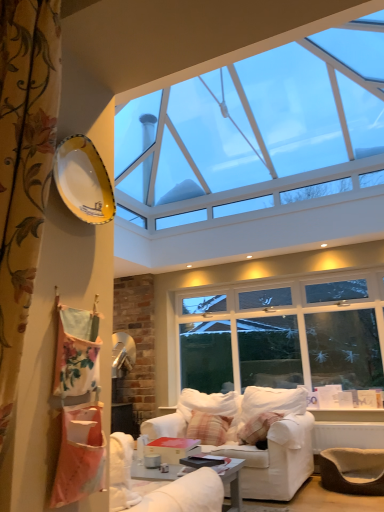
Question: Could you tell me if transparent glass window at upper center is turned towards yellow glossy plate at upper left?

Choices:
 (A) yes
 (B) no

Answer: (B)

Question: Would you say transparent glass window at upper center is a long distance from yellow glossy plate at upper left?

Choices:
 (A) yes
 (B) no

Answer: (A)

Question: From the image's perspective, is transparent glass window at upper center beneath yellow glossy plate at upper left?

Choices:
 (A) yes
 (B) no

Answer: (B)

Question: Is yellow glossy plate at upper left located within transparent glass window at upper center?

Choices:
 (A) yes
 (B) no

Answer: (B)

Question: Does transparent glass window at upper center appear on the right side of yellow glossy plate at upper left?

Choices:
 (A) yes
 (B) no

Answer: (A)

Question: Considering the positions of white fabric couch at center and plaid fabric pillow at center in the image, is white fabric couch at center bigger or smaller than plaid fabric pillow at center?

Choices:
 (A) big
 (B) small

Answer: (A)

Question: Choose the correct answer: Is white fabric couch at center inside plaid fabric pillow at center or outside it?

Choices:
 (A) inside
 (B) outside

Answer: (B)

Question: From a real-world perspective, is white fabric couch at center positioned above or below plaid fabric pillow at center?

Choices:
 (A) below
 (B) above

Answer: (A)

Question: From the image's perspective, is white fabric couch at center above or below plaid fabric pillow at center?

Choices:
 (A) below
 (B) above

Answer: (A)

Question: Considering the positions of transparent glass window at upper center and plaid fabric pillow at center in the image, is transparent glass window at upper center bigger or smaller than plaid fabric pillow at center?

Choices:
 (A) small
 (B) big

Answer: (B)

Question: Visually, is transparent glass window at upper center positioned to the left or to the right of plaid fabric pillow at center?

Choices:
 (A) left
 (B) right

Answer: (A)

Question: Is point [276, 151] positioned closer to the camera than point [206, 428]?

Choices:
 (A) farther
 (B) closer

Answer: (A)

Question: Is transparent glass window at upper center spatially inside plaid fabric pillow at center, or outside of it?

Choices:
 (A) inside
 (B) outside

Answer: (B)

Question: Considering their positions, is plaid fabric pillow at center located in front of or behind yellow glossy plate at upper left?

Choices:
 (A) behind
 (B) front

Answer: (A)

Question: Considering the positions of plaid fabric pillow at center and yellow glossy plate at upper left in the image, is plaid fabric pillow at center bigger or smaller than yellow glossy plate at upper left?

Choices:
 (A) small
 (B) big

Answer: (B)